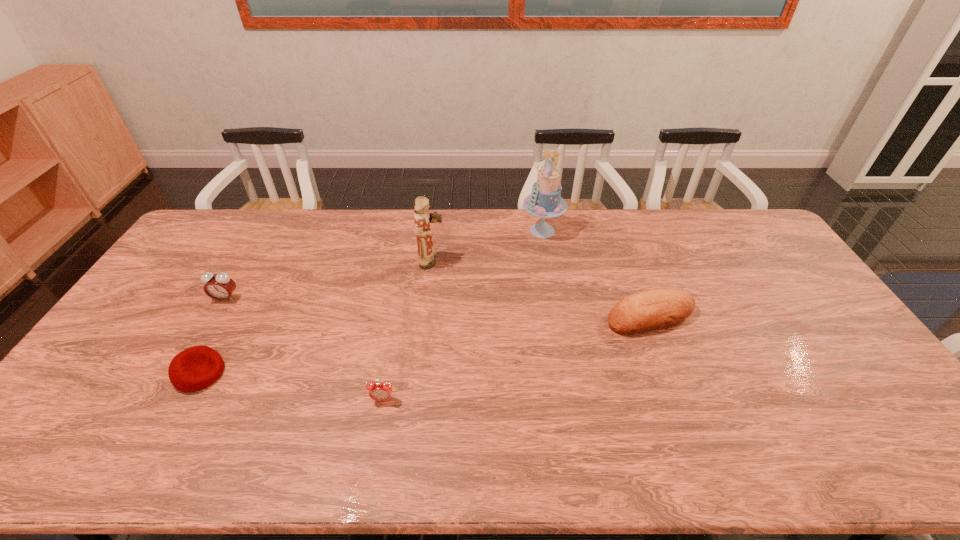
The width and height of the screenshot is (960, 540). In order to click on blank region between the tallest object and the shorter alarm clock in this screenshot , I will do `click(463, 315)`.

You are a GUI agent. You are given a task and a screenshot of the screen. Output one action in this format:
    pyautogui.click(x=<x>, y=<y>)
    Task: Click on the empty location between the beanbag and the fifth nearest object
    Image resolution: width=960 pixels, height=540 pixels.
    Given the screenshot: What is the action you would take?
    pyautogui.click(x=316, y=318)

At what (x,y) coordinates should I click in order to perform the action: click on vacant area between the beanbag and the shorter alarm clock. Please return your answer as a coordinate pair (x, y). This screenshot has width=960, height=540. Looking at the image, I should click on (291, 387).

Identify the location of vacant point located between the rightmost object and the second object from right to left. The image size is (960, 540). (596, 274).

Find the location of `the third closest object to the third object from right to left`. the third closest object to the third object from right to left is located at coordinates (656, 309).

Identify which object is the fourth closest to the shorter alarm clock. Please provide its 2D coordinates. Your answer should be formatted as a tuple, i.e. [(x, y)], where the tuple contains the x and y coordinates of a point satisfying the conditions above.

[(656, 309)]

Where is `vacant region that satisfies the following two spatial constraints: 1. with a ladder on the side of the farthest object; 2. on the right side of the rightmost object`? vacant region that satisfies the following two spatial constraints: 1. with a ladder on the side of the farthest object; 2. on the right side of the rightmost object is located at coordinates (557, 317).

You are a GUI agent. You are given a task and a screenshot of the screen. Output one action in this format:
    pyautogui.click(x=<x>, y=<y>)
    Task: Click on the free location that satisfies the following two spatial constraints: 1. on the front-facing side of the figurine; 2. on the clock face of the left alarm clock
    Image resolution: width=960 pixels, height=540 pixels.
    Given the screenshot: What is the action you would take?
    point(428,299)

In order to click on free space in the image that satisfies the following two spatial constraints: 1. with a ladder on the side of the cake; 2. on the face of the nearest object in this screenshot , I will do `click(571, 400)`.

Where is `free point that satisfies the following two spatial constraints: 1. on the back side of the rightmost object; 2. with a ladder on the side of the second object from right to left`? free point that satisfies the following two spatial constraints: 1. on the back side of the rightmost object; 2. with a ladder on the side of the second object from right to left is located at coordinates (618, 231).